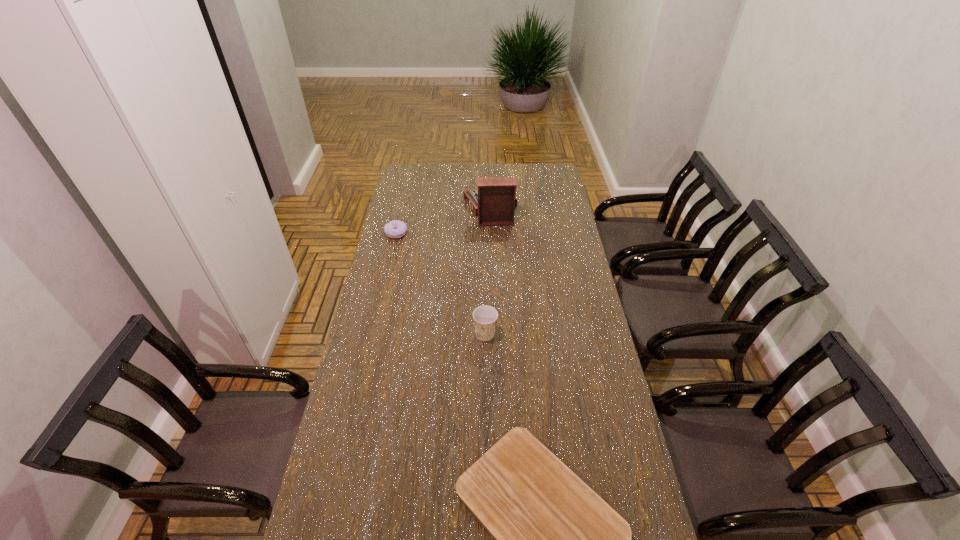
Locate an element on the screen. free space at the left edge of the desktop is located at coordinates (371, 397).

Identify the location of vacant space at the right edge. The height and width of the screenshot is (540, 960). (551, 224).

Locate an element on the screen. Image resolution: width=960 pixels, height=540 pixels. free space at the far left corner is located at coordinates (417, 178).

Locate an element on the screen. This screenshot has height=540, width=960. vacant space at the far right corner of the desktop is located at coordinates (559, 171).

Where is `vacant region between the third tallest object and the second nearest object`? This screenshot has width=960, height=540. vacant region between the third tallest object and the second nearest object is located at coordinates (441, 284).

Where is `vacant area that lies between the tallest object and the Dixie cup`? This screenshot has height=540, width=960. vacant area that lies between the tallest object and the Dixie cup is located at coordinates (488, 271).

Where is `free space between the doughnut and the Dixie cup`? Image resolution: width=960 pixels, height=540 pixels. free space between the doughnut and the Dixie cup is located at coordinates (441, 284).

At what (x,y) coordinates should I click in order to perform the action: click on free area in between the tallest object and the second shortest object. Please return your answer as a coordinate pair (x, y). Looking at the image, I should click on (444, 221).

Identify which object is the second closest to the shortest object. Please provide its 2D coordinates. Your answer should be formatted as a tuple, i.e. [(x, y)], where the tuple contains the x and y coordinates of a point satisfying the conditions above.

[(394, 229)]

Where is `object that can be found as the second closest to the chopping board`? object that can be found as the second closest to the chopping board is located at coordinates (394, 229).